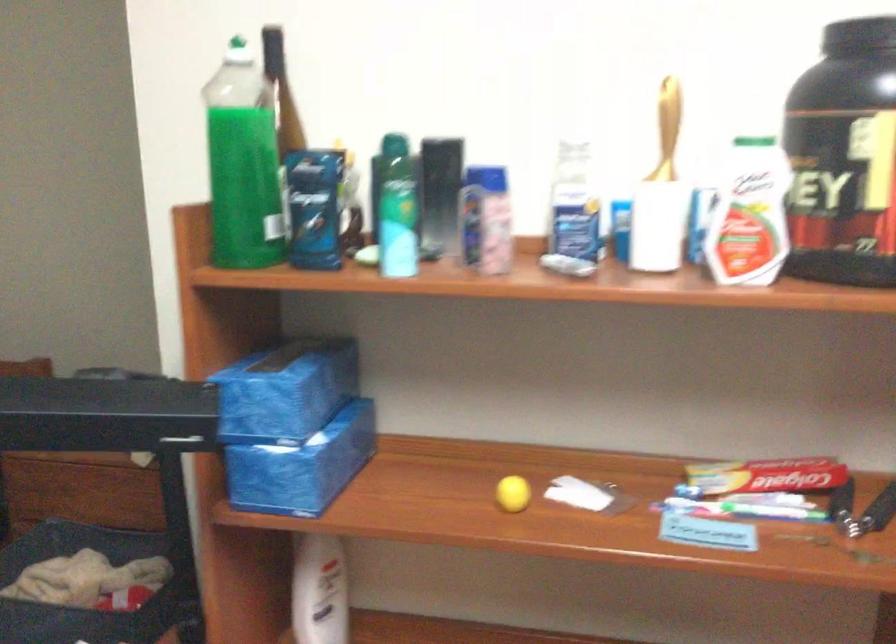
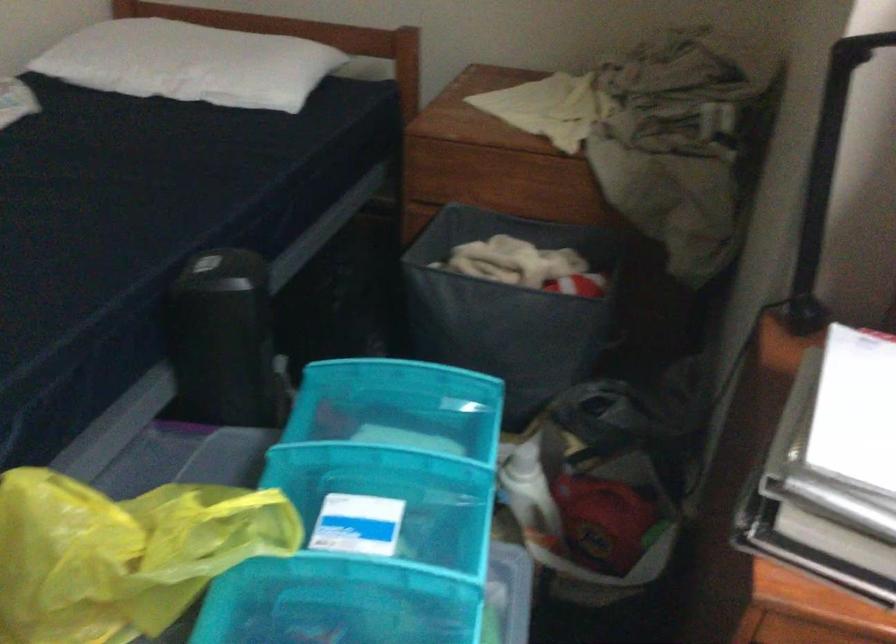
Question: The images are taken continuously from a first-person perspective. In which direction are you moving?

Choices:
 (A) Left
 (B) Right
 (C) Forward
 (D) Backward

Answer: (A)